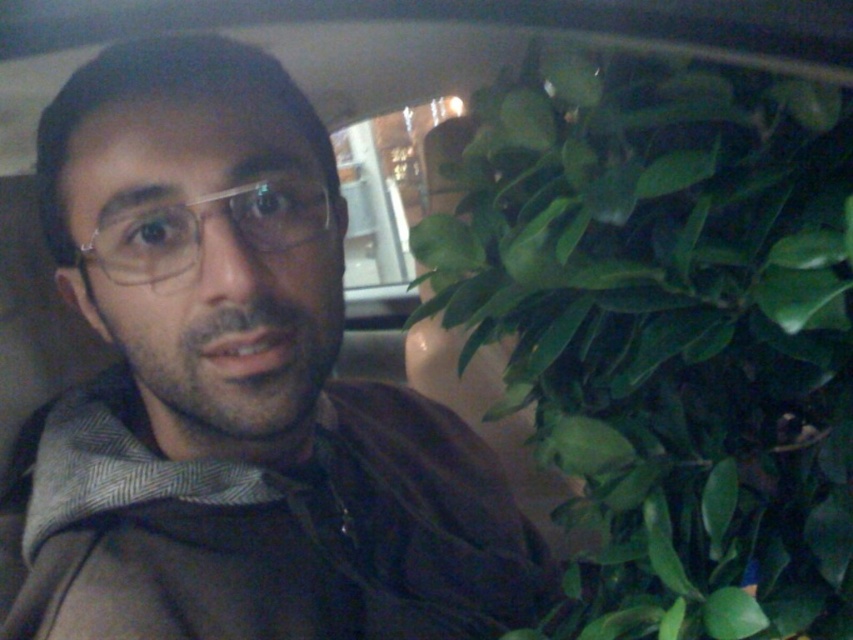
You are a passenger in a car at night. You notice a point marked at coordinates (234, 392) in the scene. What object is located at that point?

The point at coordinates (234, 392) marks the brown fabric at center.

You are a passenger in a car at night. You notice a point at coordinates (663,330) in the scene. What object is located at this point?

The point at coordinates (663,330) corresponds to the green matte leafy plant at right.

You are a delivery person who needs to place a small box between the brown fabric at center and the green matte leafy plant at right in the car. The box is 18 centimeters long. Will it fit between them?

The brown fabric at center and green matte leafy plant at right are 19.14 centimeters apart. Since the box is 18 centimeters long, it will fit between them with 1.14 centimeters of space remaining.